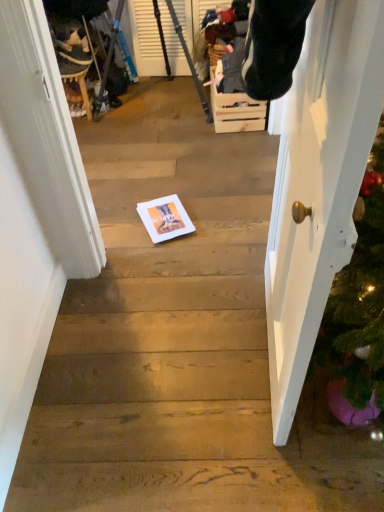
Where is `free space to the right of white paper at center`? The width and height of the screenshot is (384, 512). free space to the right of white paper at center is located at coordinates (210, 218).